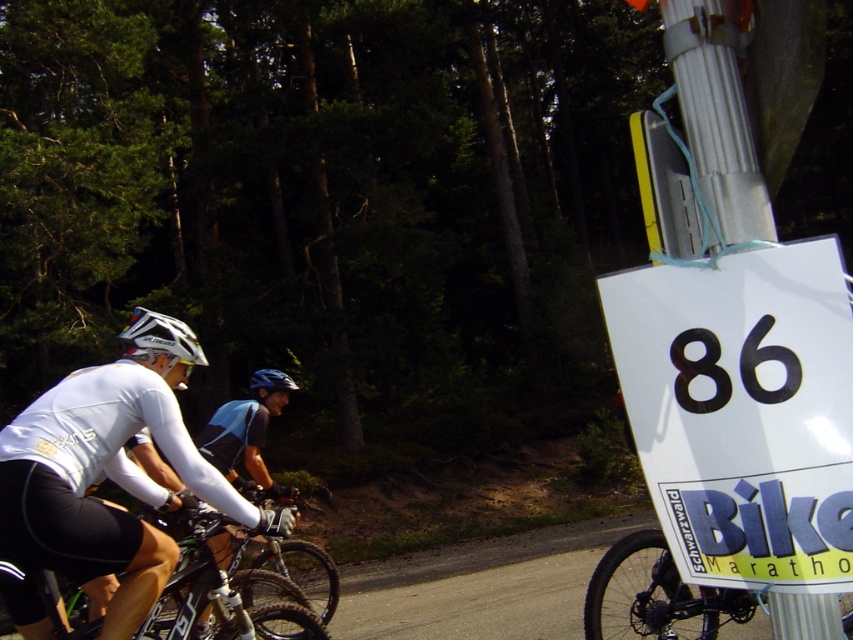
You are a race official measuring the safety distance between the green matte bicycle at center and the shiny blue helmet at center. What is the minimum safe distance required between these two items according to the marathon rules?

The minimum safe distance required between the green matte bicycle at center and the shiny blue helmet at center is 2.44 meters, which is the current distance between them.